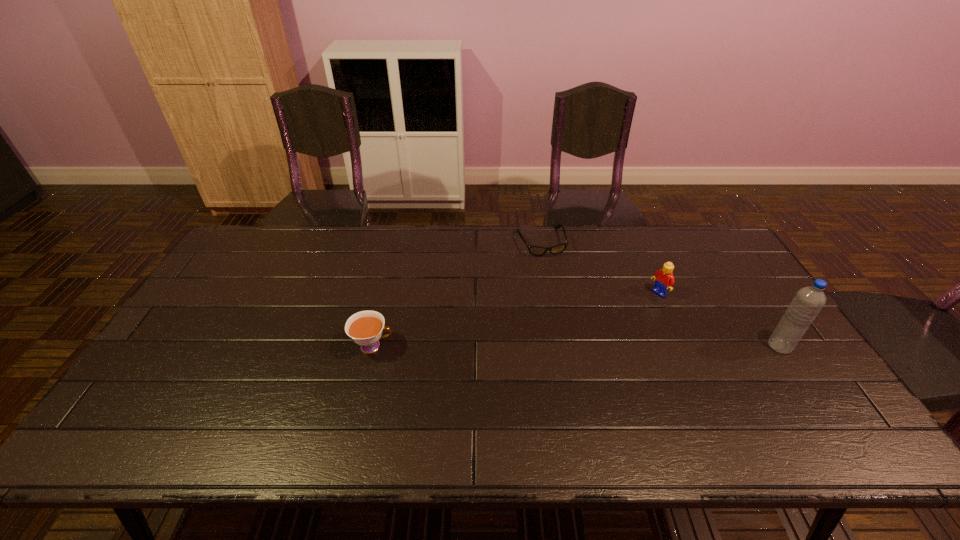
Identify the location of vacant point located between the tallest object and the second shortest object. This screenshot has height=540, width=960. (576, 346).

Locate an element on the screen. unoccupied area between the water bottle and the teacup is located at coordinates (576, 346).

Identify which object is located as the second nearest to the rightmost object. Please provide its 2D coordinates. Your answer should be formatted as a tuple, i.e. [(x, y)], where the tuple contains the x and y coordinates of a point satisfying the conditions above.

[(557, 249)]

Identify which object is the closest to the leftmost object. Please provide its 2D coordinates. Your answer should be formatted as a tuple, i.e. [(x, y)], where the tuple contains the x and y coordinates of a point satisfying the conditions above.

[(557, 249)]

Image resolution: width=960 pixels, height=540 pixels. I want to click on vacant space that satisfies the following two spatial constraints: 1. on the front side of the rightmost object; 2. on the left side of the third nearest object, so click(x=682, y=346).